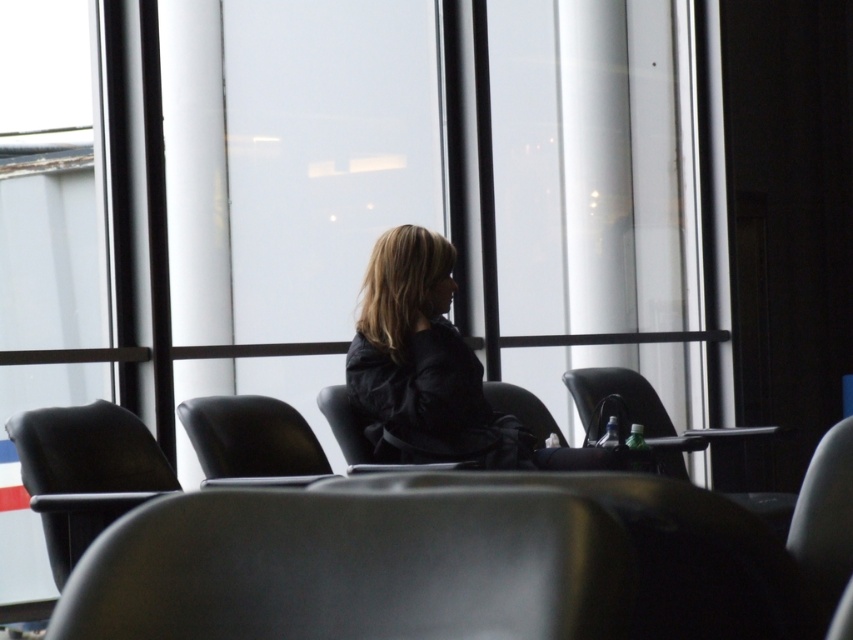
Does matte black armchair at left have a greater height compared to black leather chair at center?

Yes, matte black armchair at left is taller than black leather chair at center.

Does matte black armchair at left have a lesser height compared to black leather chair at center?

No.

At what (x,y) coordinates should I click in order to perform the action: click on matte black armchair at left. Please return your answer as a coordinate pair (x, y). This screenshot has width=853, height=640. Looking at the image, I should click on (85, 472).

Does matte black armchair at left have a larger size compared to black leather armchair at center?

Yes.

Where is `matte black armchair at left`? matte black armchair at left is located at coordinates (85, 472).

Which is in front, point (62, 452) or point (231, 417)?

Point (62, 452)

You are a GUI agent. You are given a task and a screenshot of the screen. Output one action in this format:
    pyautogui.click(x=<x>, y=<y>)
    Task: Click on the matte black armchair at left
    The height and width of the screenshot is (640, 853).
    Given the screenshot: What is the action you would take?
    pyautogui.click(x=85, y=472)

Does black matte jacket at center have a greater height compared to black leather chair at center?

Yes, black matte jacket at center is taller than black leather chair at center.

Which is more to the left, black matte jacket at center or black leather chair at center?

black matte jacket at center

Image resolution: width=853 pixels, height=640 pixels. In order to click on black matte jacket at center in this screenshot , I will do `click(434, 371)`.